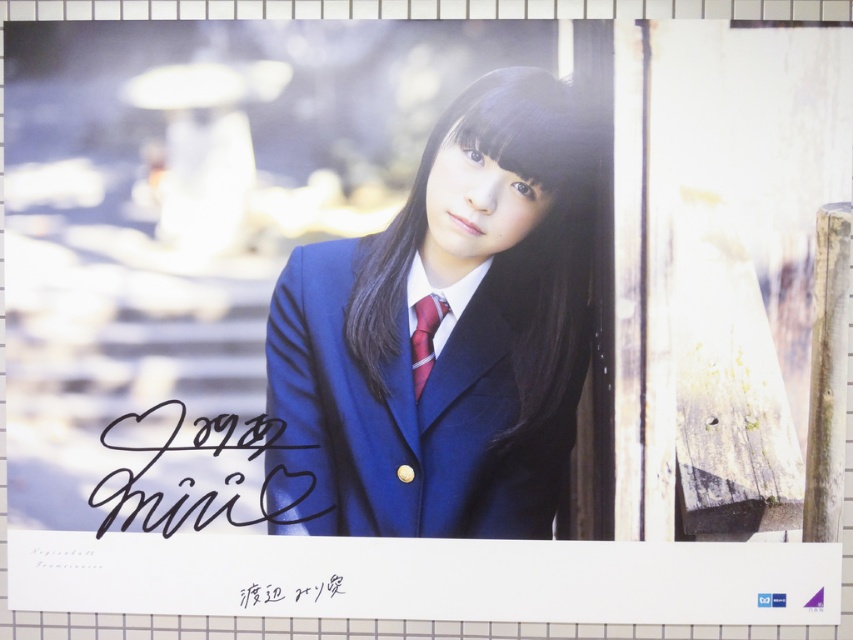
You are a photographer reviewing the image. You need to determine the spatial relationship between the matte blue blazer at center and the black ink signature at center. Which object is positioned higher in the image?

The matte blue blazer at center is above the black ink signature at center, so it is positioned higher.

You are a photographer reviewing this image. You need to ensure that both the matte blue blazer at center and the black ink signature at center are clearly visible in the final print. Based on their sizes, which object should you focus on enlarging to maintain clarity without distortion?

The matte blue blazer at center is taller than the black ink signature at center. To maintain clarity without distortion, you should focus on enlarging the black ink signature at center since it is smaller.

You are an artist analyzing the composition of this portrait. You notice two central elements, the black ink signature at center and the shiny red tie at center. Which of these two elements is visually more prominent in terms of size?

The black ink signature at center has a larger size compared to the shiny red tie at center, making it more prominent in terms of size.